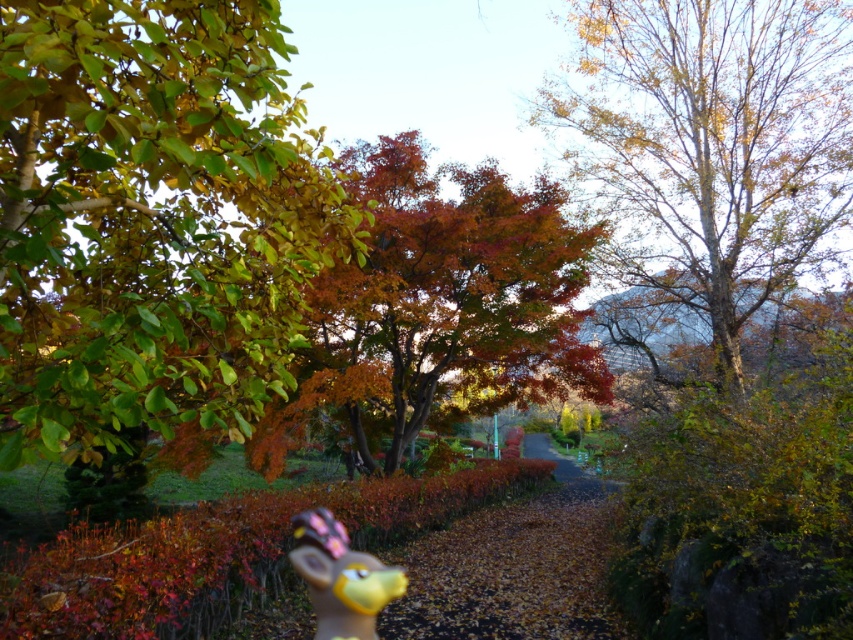
Question: Considering the real-world distances, which object is closest to the autumn leaves at center?

Choices:
 (A) yellow-green bark tree at upper right
 (B) matte yellow plush toy at center

Answer: (A)

Question: Is the position of shiny green leaves at upper left less distant than that of matte yellow plush toy at center?

Choices:
 (A) yes
 (B) no

Answer: (A)

Question: Is autumn leaves at center behind brown dirt path at center?

Choices:
 (A) no
 (B) yes

Answer: (A)

Question: Which point is closer to the camera?

Choices:
 (A) shiny green leaves at upper left
 (B) matte yellow plush toy at center
 (C) yellow-green bark tree at upper right

Answer: (A)

Question: Is yellow-green bark tree at upper right thinner than matte yellow plush toy at center?

Choices:
 (A) no
 (B) yes

Answer: (A)

Question: Considering the real-world distances, which object is farthest from the yellow-green bark tree at upper right?

Choices:
 (A) matte yellow plush toy at center
 (B) shiny green leaves at upper left

Answer: (B)